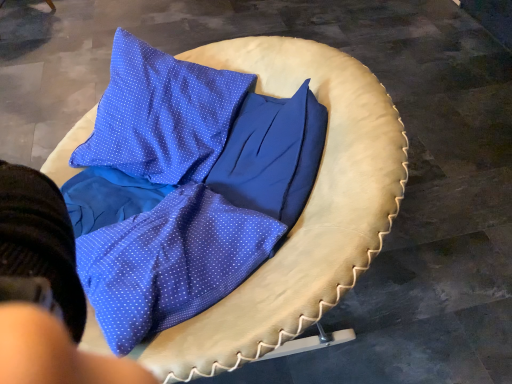
This screenshot has width=512, height=384. What are the coordinates of `blue fabric cushion at center` in the screenshot? It's located at (304, 209).

In order to face blue fabric cushion at center, should I rotate leftwards or rightwards?

You should look left and rotate roughly 12.194 degrees.

Describe the element at coordinates (304, 209) in the screenshot. The image size is (512, 384). I see `blue fabric cushion at center` at that location.

Find the location of a particular element. blue fabric cushion at center is located at coordinates 304,209.